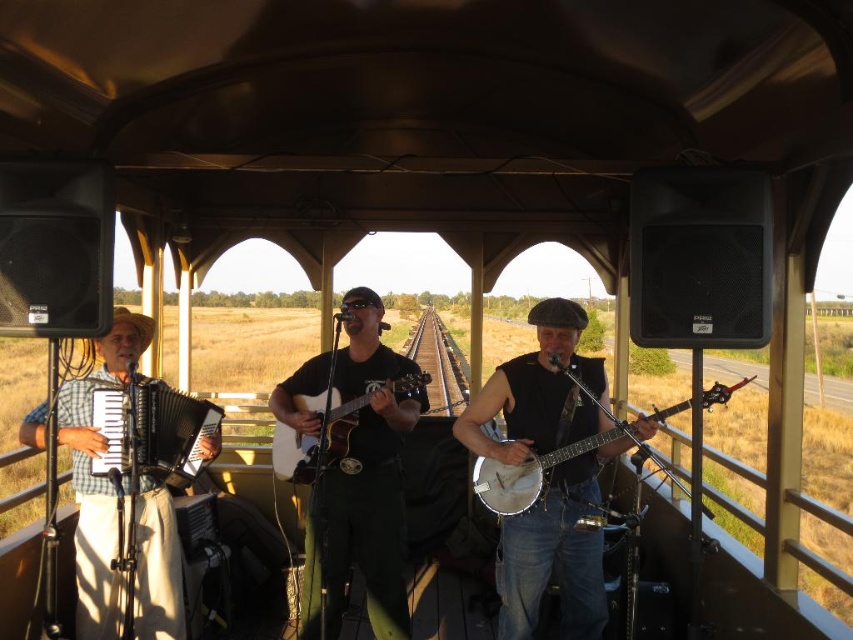
Question: Based on their relative distances, which object is nearer to the denim jeans at center?

Choices:
 (A) black leather guitar at center
 (B) wooden banjo at center
 (C) checkered fabric accordion at left

Answer: (B)

Question: Is checkered fabric accordion at left wider than matte black accordion at left?

Choices:
 (A) no
 (B) yes

Answer: (B)

Question: Among these objects, which one is farthest from the camera?

Choices:
 (A) checkered fabric accordion at left
 (B) matte black accordion at left
 (C) matte brown acoustic guitar at center
 (D) black leather guitar at center

Answer: (D)

Question: Is denim jeans at center smaller than matte brown acoustic guitar at center?

Choices:
 (A) yes
 (B) no

Answer: (B)

Question: Which is nearer to the black leather guitar at center?

Choices:
 (A) matte brown acoustic guitar at center
 (B) denim jeans at center

Answer: (A)

Question: Is denim jeans at center to the left of matte black accordion at left from the viewer's perspective?

Choices:
 (A) yes
 (B) no

Answer: (B)